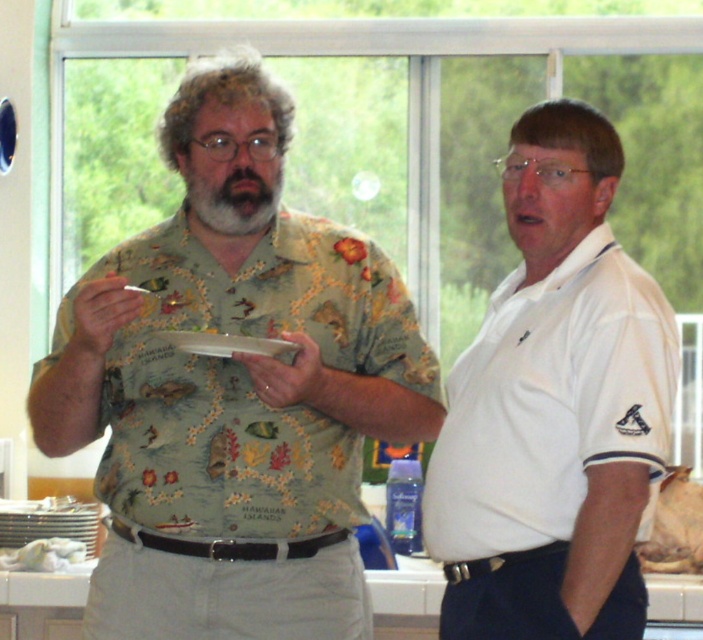
Is point (356, 634) in front of point (181, 336)?

No, (356, 634) is behind (181, 336).

Can you confirm if floral cotton shirt at center is smaller than white paper plate at center?

Actually, floral cotton shirt at center might be larger than white paper plate at center.

Which is behind, point (257, 296) or point (290, 340)?

The point (257, 296) is more distant.

You are a GUI agent. You are given a task and a screenshot of the screen. Output one action in this format:
    pyautogui.click(x=<x>, y=<y>)
    Task: Click on the floral cotton shirt at center
    Image resolution: width=703 pixels, height=640 pixels.
    Given the screenshot: What is the action you would take?
    pyautogui.click(x=233, y=388)

In the scene shown: Is brown crumbly bread at right taller than white paper plate at center?

Indeed, brown crumbly bread at right has a greater height compared to white paper plate at center.

Does brown crumbly bread at right appear on the right side of white paper plate at center?

Correct, you'll find brown crumbly bread at right to the right of white paper plate at center.

What are the coordinates of `brown crumbly bread at right` in the screenshot? It's located at (676, 525).

Who is shorter, floral cotton shirt at center or brown crumbly bread at right?

Standing shorter between the two is brown crumbly bread at right.

Who is more distant from viewer, [340,477] or [681,502]?

The point [681,502] is more distant.

At what (x,y) coordinates should I click in order to perform the action: click on floral cotton shirt at center. Please return your answer as a coordinate pair (x, y). This screenshot has width=703, height=640. Looking at the image, I should click on (233, 388).